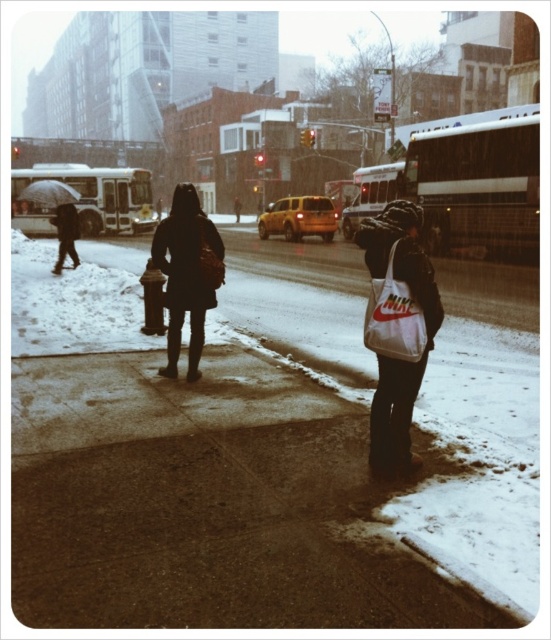
Can you confirm if white fabric tote bag at center-right is thinner than dark matte coat at center?

Correct, white fabric tote bag at center-right's width is less than dark matte coat at center's.

Is point (397, 323) more distant than point (185, 221)?

No, (397, 323) is closer to viewer.

Where is `white fabric tote bag at center-right`? This screenshot has height=640, width=551. white fabric tote bag at center-right is located at coordinates (397, 324).